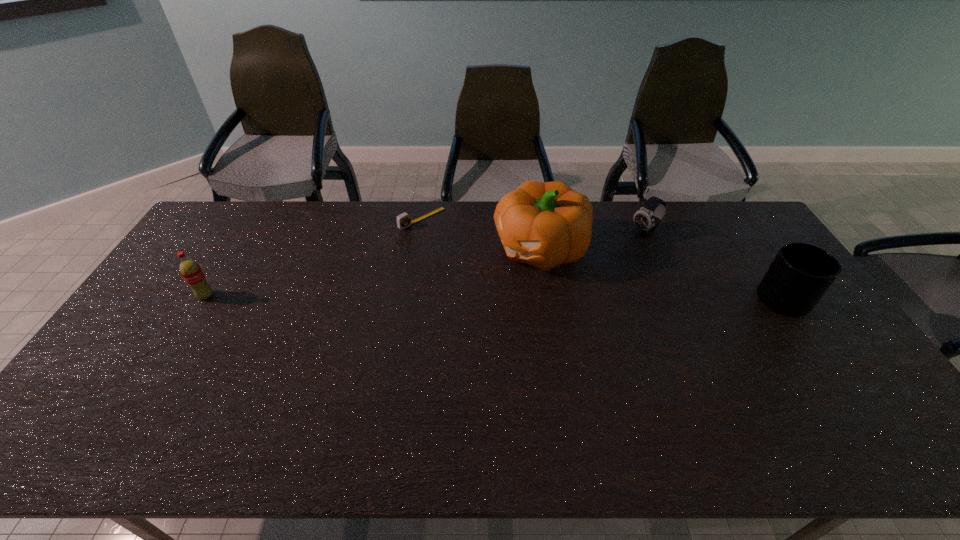
Find the location of a particular element. Image resolution: width=960 pixels, height=540 pixels. vacant spot on the desktop that is between the leftmost object and the mug and is positioned on the carved face of the pumpkin is located at coordinates (451, 298).

Locate an element on the screen. The width and height of the screenshot is (960, 540). vacant space on the desktop that is between the soda and the rightmost object and is positioned at the front of the second object from left to right with the tape extended is located at coordinates (520, 298).

Image resolution: width=960 pixels, height=540 pixels. I want to click on vacant spot on the desktop that is between the soda and the rightmost object and is positioned on the face of the watch, so click(543, 298).